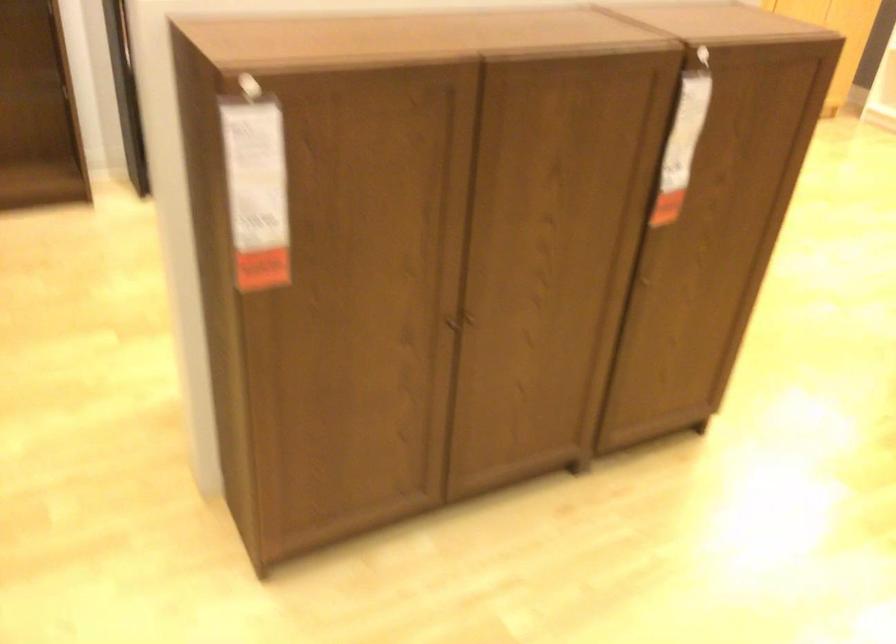
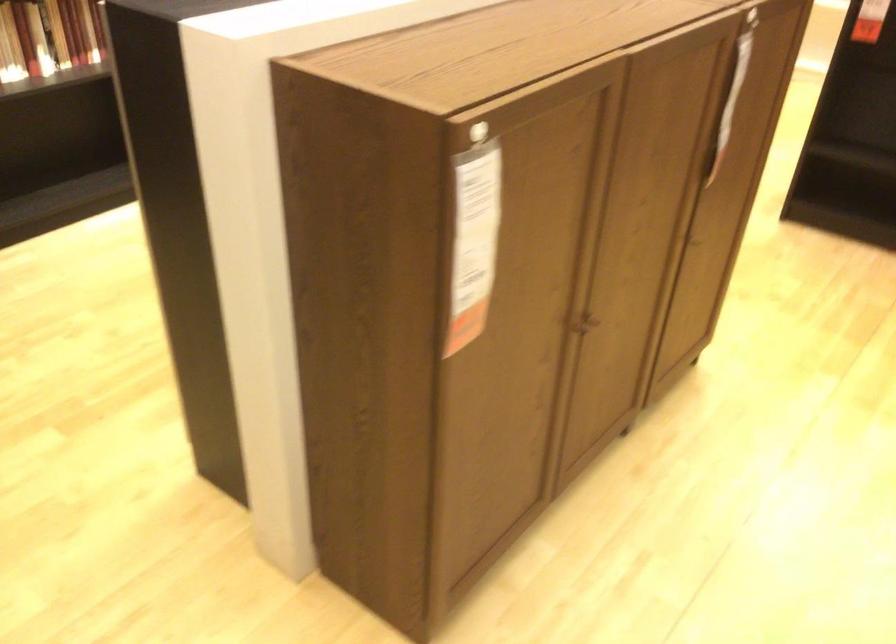
In the second image, find the point that corresponds to the point at 446,317 in the first image.

(583, 323)